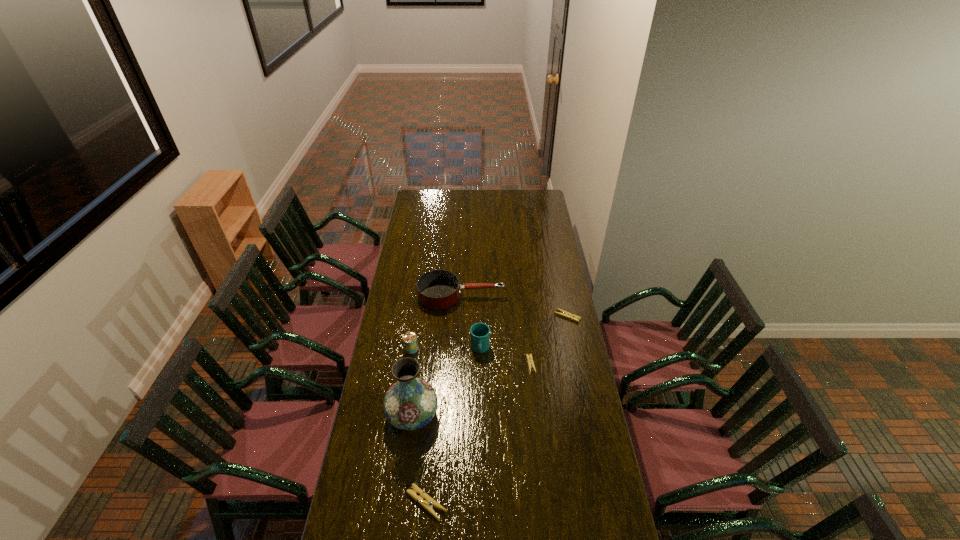
You are a GUI agent. You are given a task and a screenshot of the screen. Output one action in this format:
    pyautogui.click(x=<x>, y=<y>)
    Task: Click on the unoccupied area between the tallest object and the pan
    
    Given the screenshot: What is the action you would take?
    pyautogui.click(x=437, y=356)

This screenshot has height=540, width=960. I want to click on blank region between the fourth tallest object and the rightmost object, so click(x=515, y=306).

This screenshot has width=960, height=540. In order to click on free space that is in between the second nearest object and the fourth shortest object in this screenshot , I will do `click(437, 356)`.

Identify the location of free space between the fourth tallest object and the can. The height and width of the screenshot is (540, 960). (437, 322).

Identify the location of vacant space in between the sixth farthest object and the second shortest object. Image resolution: width=960 pixels, height=540 pixels. (490, 366).

The image size is (960, 540). Find the location of `vacant region between the farthest clothespin and the fifth tallest object`. vacant region between the farthest clothespin and the fifth tallest object is located at coordinates (497, 410).

Where is `free space between the cup and the rightmost object`? The height and width of the screenshot is (540, 960). free space between the cup and the rightmost object is located at coordinates (523, 333).

This screenshot has height=540, width=960. Find the location of `object that is the third closest one to the second nearest clothespin`. object that is the third closest one to the second nearest clothespin is located at coordinates (439, 289).

Locate which object ranks in proximity to the pan. Please provide its 2D coordinates. Your answer should be formatted as a tuple, i.e. [(x, y)], where the tuple contains the x and y coordinates of a point satisfying the conditions above.

[(479, 332)]

At what (x,y) coordinates should I click in order to perform the action: click on clothespin that is the closest to the vase. Please return your answer as a coordinate pair (x, y). This screenshot has height=540, width=960. Looking at the image, I should click on (424, 500).